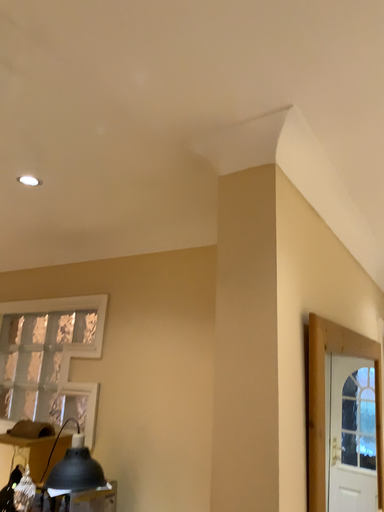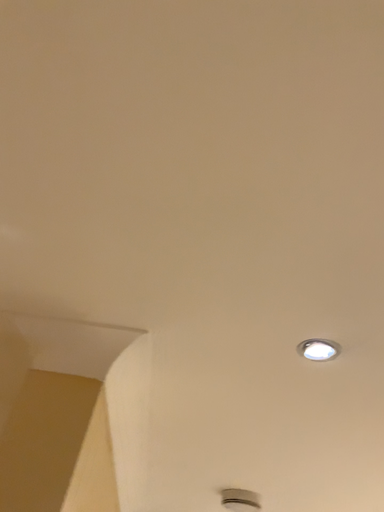
Question: Which way did the camera rotate in the video?

Choices:
 (A) rotated left
 (B) rotated right

Answer: (B)